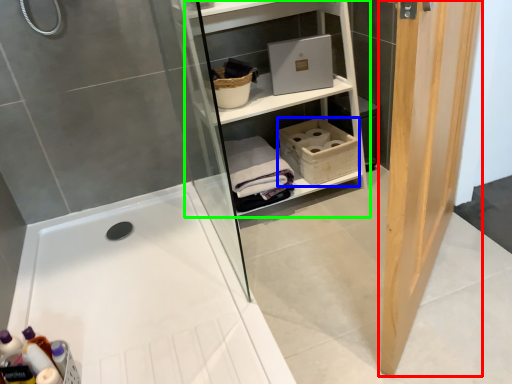
Question: Based on their relative distances, which object is farther from door (highlighted by a red box)? Choose from basket (highlighted by a blue box) and shelf (highlighted by a green box).

Choices:
 (A) basket
 (B) shelf

Answer: (A)